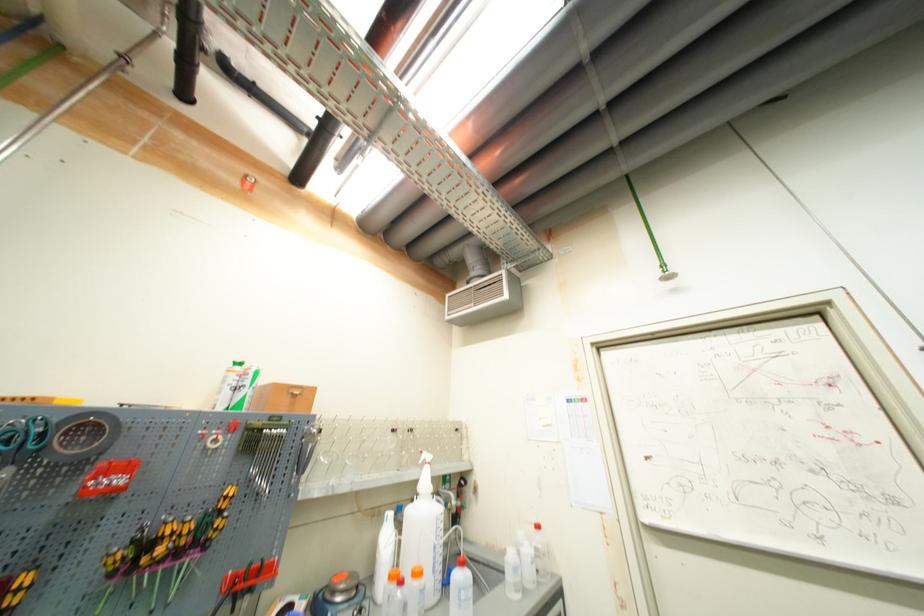
The height and width of the screenshot is (616, 924). I want to click on white bottle trigger, so click(296, 390).